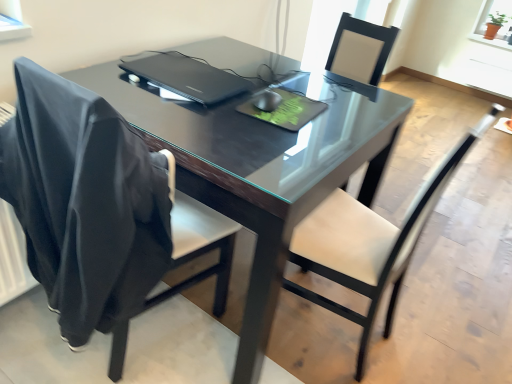
Identify the location of free spot below white leather chair at center, which is the 1th chair from right to left (from a real-world perspective). The height and width of the screenshot is (384, 512). (333, 334).